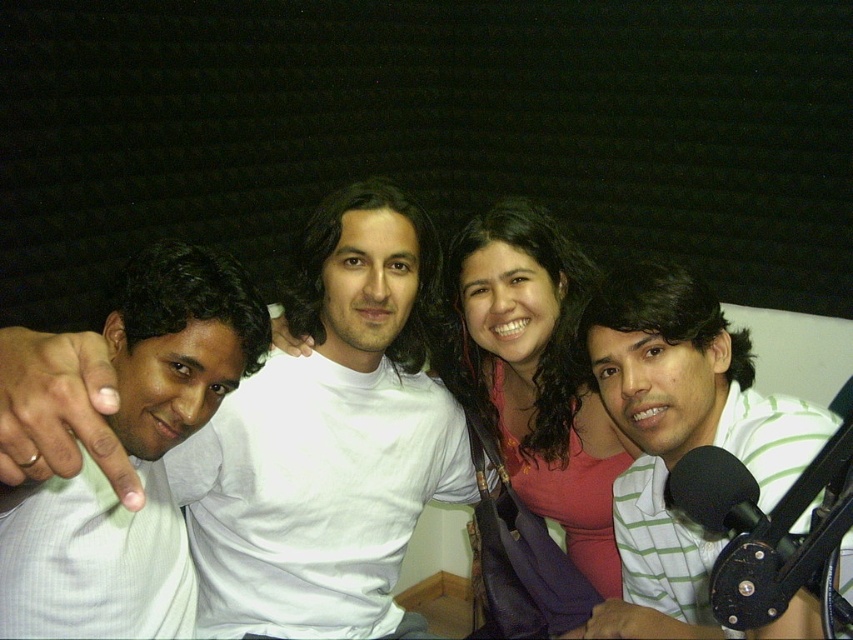
Question: Can you confirm if white matte t-shirt at center is smaller than pink fabric at center?

Choices:
 (A) no
 (B) yes

Answer: (A)

Question: Can you confirm if white matte t-shirt at center is positioned to the left of white striped shirt at center?

Choices:
 (A) yes
 (B) no

Answer: (A)

Question: Is white matte t-shirt at center above white striped shirt at center?

Choices:
 (A) yes
 (B) no

Answer: (B)

Question: Which object is the closest to the pink fabric at center?

Choices:
 (A) white striped shirt at center
 (B) white shirt at left
 (C) white matte t-shirt at center

Answer: (A)

Question: Which object is the farthest from the white striped shirt at center?

Choices:
 (A) white matte t-shirt at center
 (B) pink fabric at center
 (C) white shirt at left

Answer: (C)

Question: Which point appears closest to the camera in this image?

Choices:
 (A) (654, 442)
 (B) (556, 492)
 (C) (138, 330)
 (D) (361, 328)

Answer: (C)